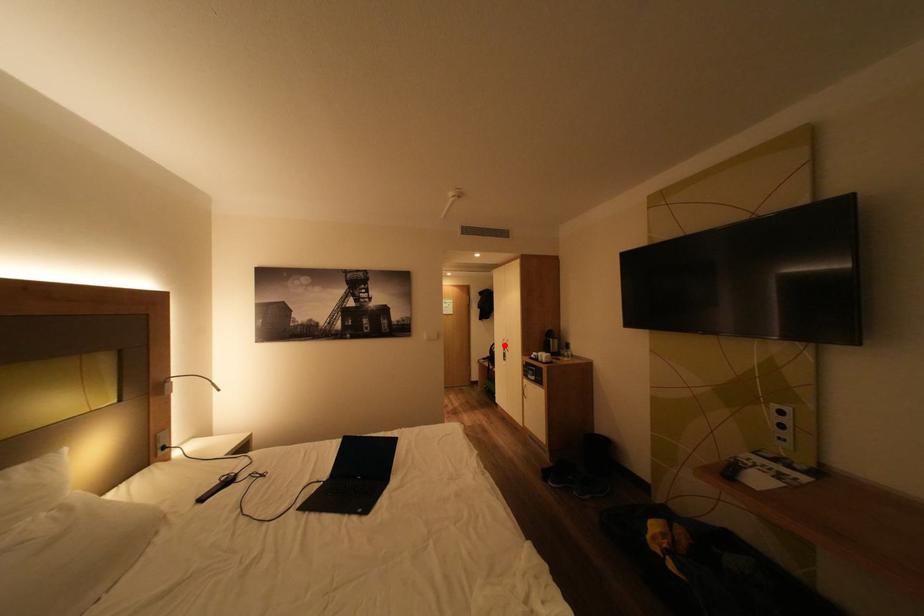
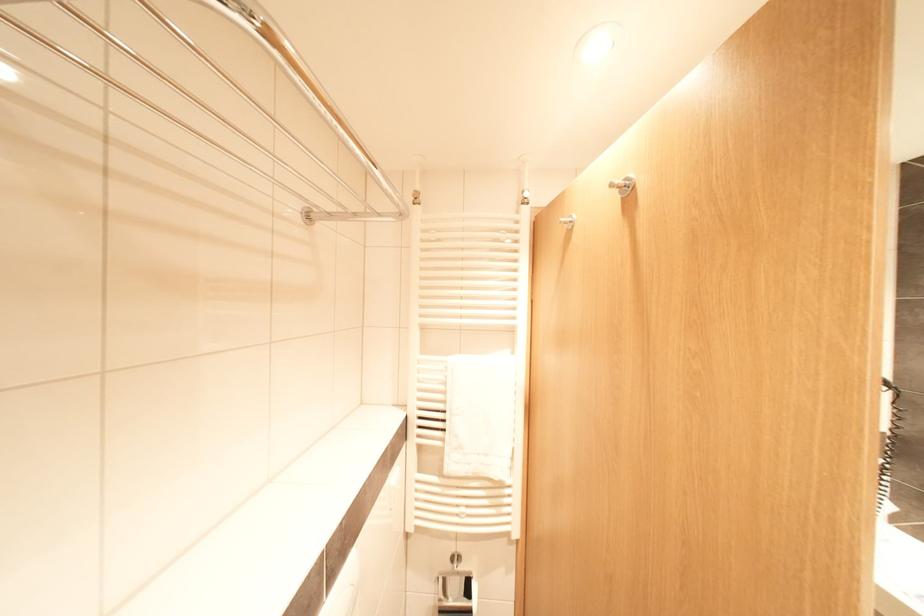
Question: I am providing you with two images of the same scene from different viewpoints. A red point is marked on the first image. Can you still see the location of the red point in image 2?

Choices:
 (A) Yes
 (B) No

Answer: (B)